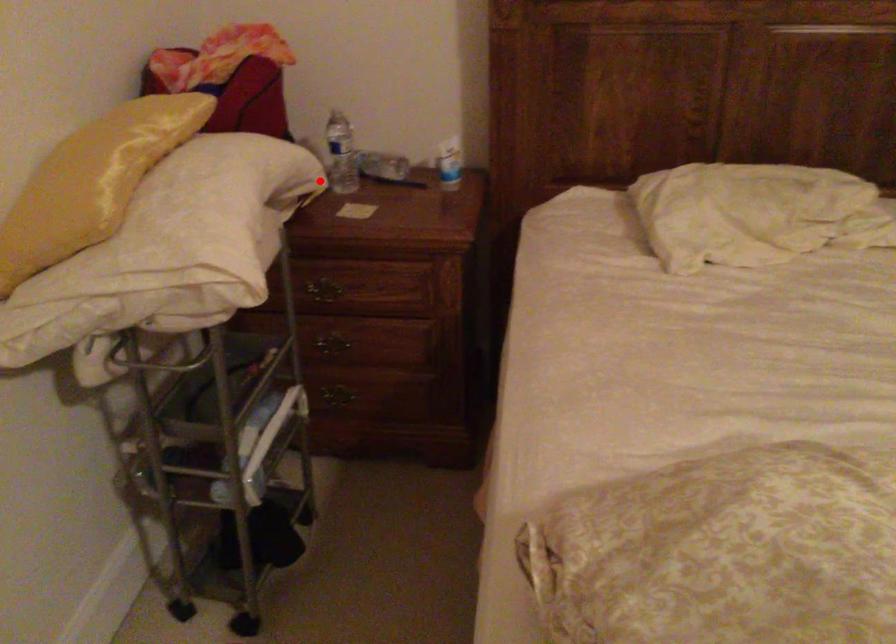
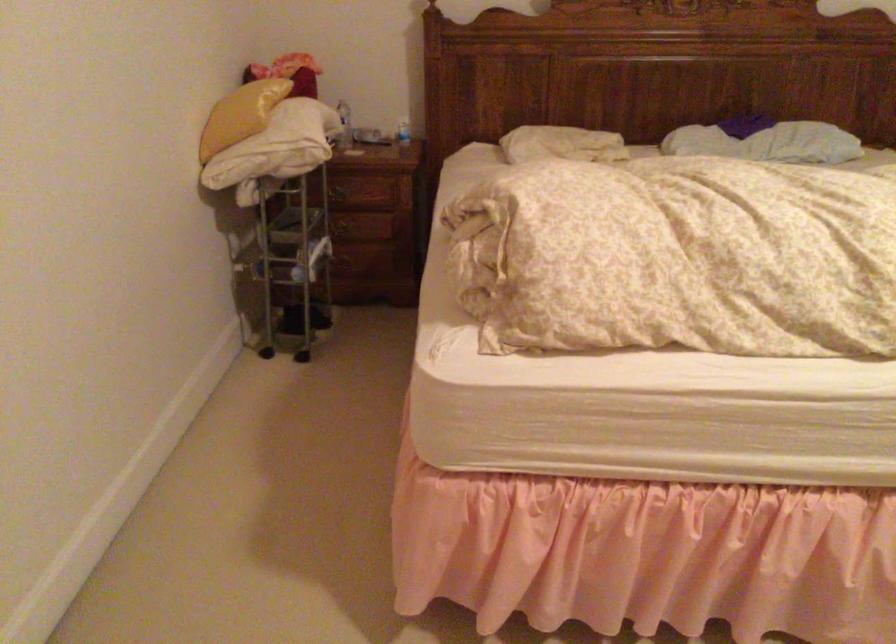
In the second image, find the point that corresponds to the highlighted location in the first image.

(343, 125)